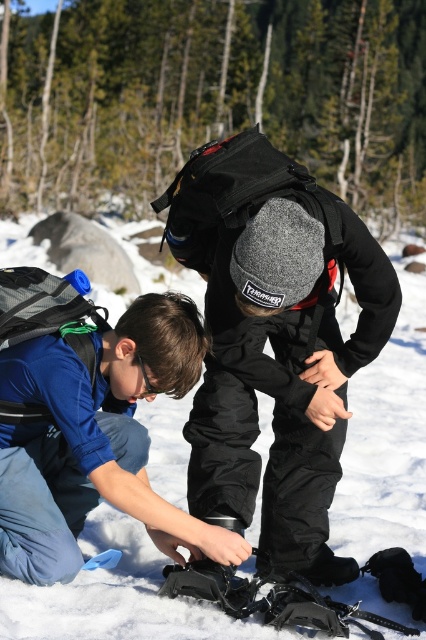
Consider the image. You are planning to build a snowman using the white fluffy snow at center and the black plastic snowshoe at lower center. Which object should you use as the base of the snowman?

The white fluffy snow at center is to the left of the black plastic snowshoe at lower center, so you should use the white fluffy snow at center as the base since it is more accessible from the left side.

You are planning to set up a tent in the snowy area between the white fluffy snow at center and the black plastic snowshoe at lower center. The tent requires a space of 2 meters between the two objects to be placed. Can you fit the tent in this location?

The white fluffy snow at center and black plastic snowshoe at lower center are 2.42 meters apart from each other. Since the required space is 2 meters, the tent can be placed here as there is sufficient space between them.

You are standing at the point labeled point (88,536). You want to walk to the point labeled point (250,586). Is the point you want to reach in front of or behind you?

The point labeled point (250,586) is in front of you because you are at point (88,536), and the description states that point (88,536) is behind point (250,586).